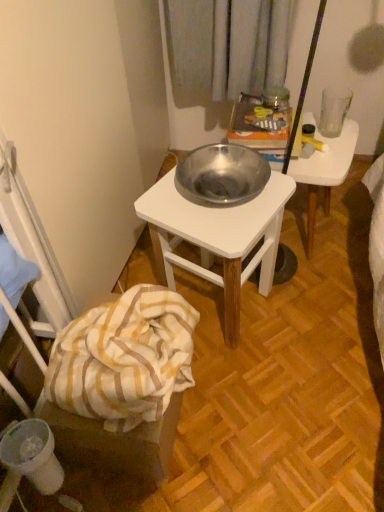
Question: Considering the relative positions of metallic white table at center and yellow striped fabric at lower left in the image provided, is metallic white table at center to the left or to the right of yellow striped fabric at lower left?

Choices:
 (A) right
 (B) left

Answer: (A)

Question: Is metallic white table at center taller or shorter than yellow striped fabric at lower left?

Choices:
 (A) short
 (B) tall

Answer: (B)

Question: Based on their relative distances, which object is nearer to the yellow striped fabric at lower left?

Choices:
 (A) transparent glass at upper right
 (B) metallic white table at center
 (C) metallic silver bowl at center
 (D) white striped fabric at lower left

Answer: (D)

Question: Based on their relative distances, which object is nearer to the yellow striped fabric at lower left?

Choices:
 (A) transparent glass at upper right
 (B) white striped fabric at lower left
 (C) metallic silver bowl at center
 (D) metallic white table at center

Answer: (B)